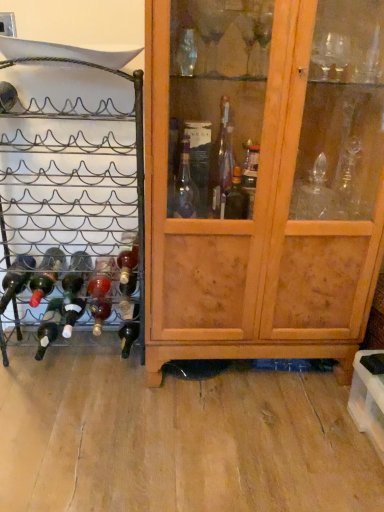
Where is `space that is in front of wooden cabinet at center`? space that is in front of wooden cabinet at center is located at coordinates (242, 440).